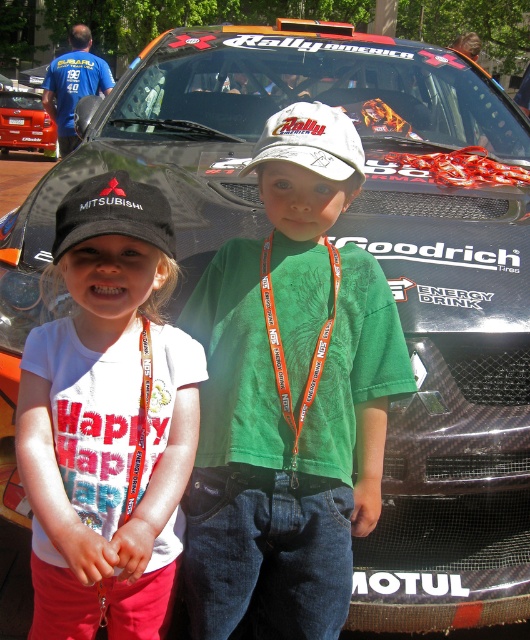
Who is taller, white cotton shirt at center or black fabric cap at left?

With more height is white cotton shirt at center.

Which is above, white cotton shirt at center or black fabric cap at left?

black fabric cap at left is above.

Between point (148, 310) and point (109, 196), which one is positioned behind?

Positioned behind is point (148, 310).

You are a GUI agent. You are given a task and a screenshot of the screen. Output one action in this format:
    pyautogui.click(x=<x>, y=<y>)
    Task: Click on the white cotton shirt at center
    The height and width of the screenshot is (640, 530).
    Given the screenshot: What is the action you would take?
    pyautogui.click(x=108, y=419)

Is black fabric cap at left shorter than white matte baseball cap at center?

Indeed, black fabric cap at left has a lesser height compared to white matte baseball cap at center.

Which is behind, point (80, 214) or point (335, 118)?

Positioned behind is point (335, 118).

Which is behind, point (96, 216) or point (312, 104)?

The point (312, 104) is more distant.

This screenshot has width=530, height=640. What are the coordinates of `black fabric cap at left` in the screenshot? It's located at (112, 212).

How far apart are white cotton shirt at center and white matte baseball cap at center?

white cotton shirt at center is 27.48 inches away from white matte baseball cap at center.

Locate an element on the screen. white cotton shirt at center is located at coordinates (108, 419).